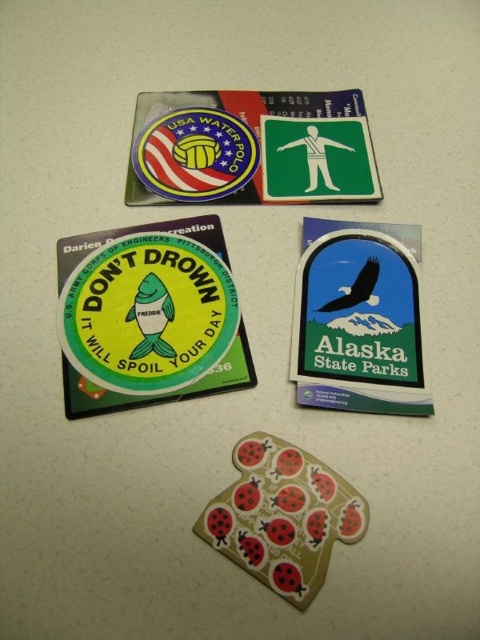
Question: Does metallic gold ladybug at center appear on the right side of green matte sticker at upper right?

Choices:
 (A) no
 (B) yes

Answer: (A)

Question: Which point is closer to the camera taking this photo?

Choices:
 (A) (352, 228)
 (B) (170, 244)
 (C) (290, 596)

Answer: (C)

Question: From the image, what is the correct spatial relationship of green matte sticker at lower left in relation to metallic gold ladybug at center?

Choices:
 (A) below
 (B) above

Answer: (B)

Question: Does green matte sticker at lower left appear over green matte sticker at upper right?

Choices:
 (A) no
 (B) yes

Answer: (A)

Question: Which object is closer to the camera taking this photo?

Choices:
 (A) green matte sticker at lower left
 (B) green matte sticker at upper right

Answer: (A)

Question: Which of the following is the farthest from the observer?

Choices:
 (A) green matte sticker at lower left
 (B) metallic gold ladybug at center

Answer: (A)